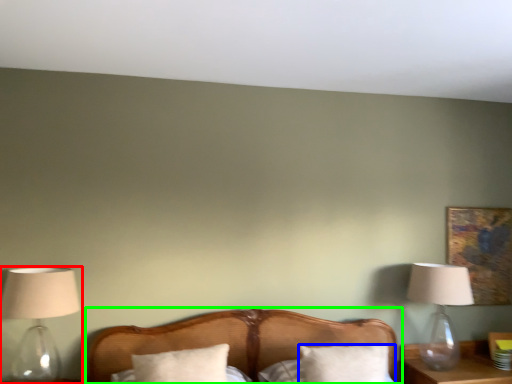
Question: Which is nearer to the lamp (highlighted by a red box)? pillow (highlighted by a blue box) or bed (highlighted by a green box).

Choices:
 (A) pillow
 (B) bed

Answer: (B)